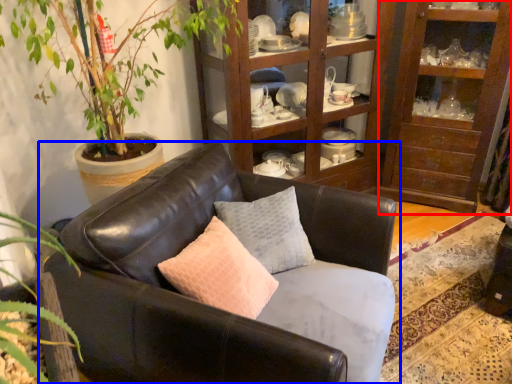
Question: Which object is closer to the camera taking this photo, shelf (highlighted by a red box) or studio couch (highlighted by a blue box)?

Choices:
 (A) shelf
 (B) studio couch

Answer: (B)